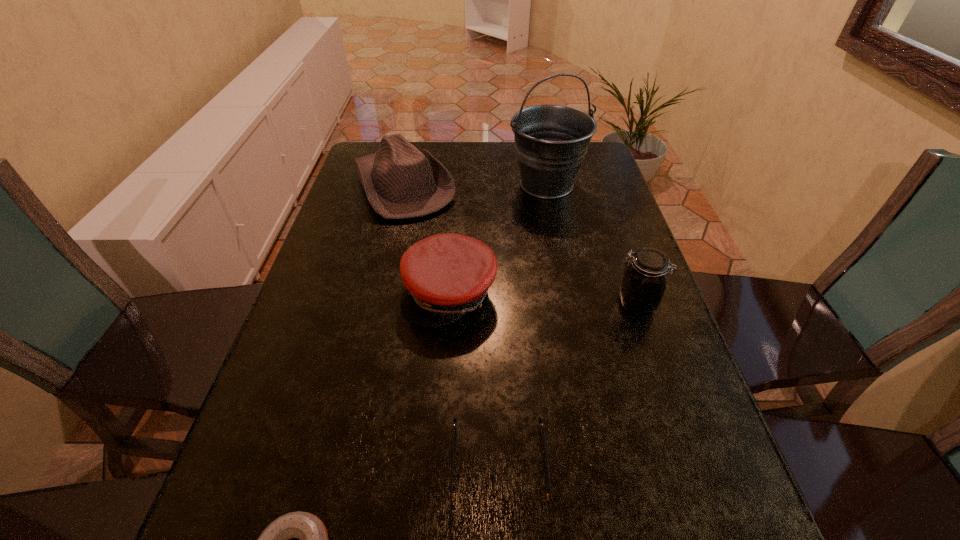
Image resolution: width=960 pixels, height=540 pixels. Find the location of `free space located on the lid of the jar`. free space located on the lid of the jar is located at coordinates (524, 303).

Identify the location of vacant space situated at the front of the cap where the visor is located. (443, 398).

Identify the location of bucket at the far edge. The image size is (960, 540). (551, 141).

This screenshot has width=960, height=540. Identify the location of fedora located at the far edge. (400, 181).

Identify the location of object at the left edge. (400, 181).

Locate an element on the screen. The width and height of the screenshot is (960, 540). bucket that is at the right edge is located at coordinates click(x=551, y=141).

Where is `jar situated at the right edge`? jar situated at the right edge is located at coordinates (643, 284).

The height and width of the screenshot is (540, 960). I want to click on object present at the far left corner, so click(x=400, y=181).

In order to click on object at the far right corner in this screenshot , I will do `click(551, 141)`.

What are the coordinates of `vacant region at the far edge of the desktop` in the screenshot? It's located at (467, 153).